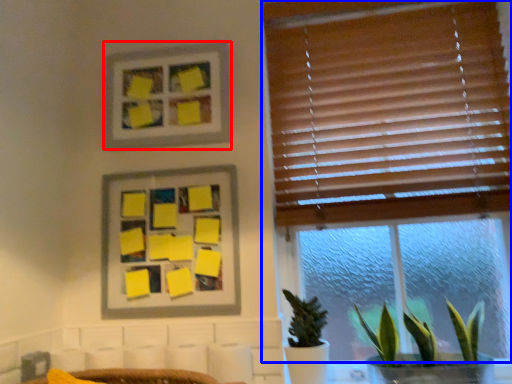
Question: Which object appears farthest to the camera in this image, picture frame (highlighted by a red box) or window (highlighted by a blue box)?

Choices:
 (A) picture frame
 (B) window

Answer: (A)